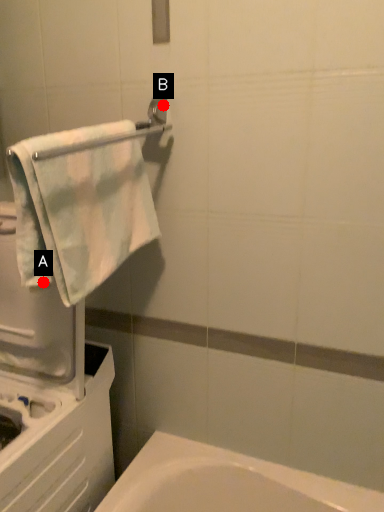
Question: Two points are circled on the image, labeled by A and B beside each circle. Which point is farther from the camera taking this photo?

Choices:
 (A) A is further
 (B) B is further

Answer: (B)